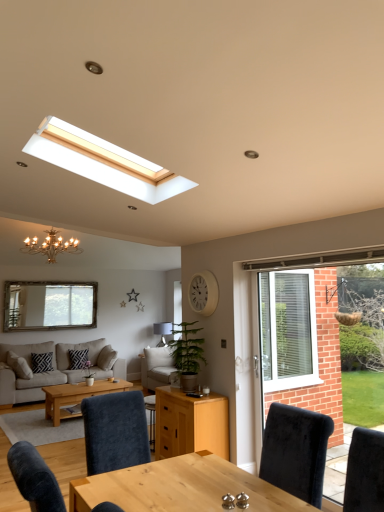
Describe the element at coordinates (54, 369) in the screenshot. I see `beige fabric couch at lower left` at that location.

The height and width of the screenshot is (512, 384). What do you see at coordinates (78, 358) in the screenshot? I see `black textured pillow at center, the second pillow viewed from the left` at bounding box center [78, 358].

The image size is (384, 512). What do you see at coordinates (51, 246) in the screenshot? I see `gold metallic chandelier at upper left` at bounding box center [51, 246].

The image size is (384, 512). What do you see at coordinates (41, 362) in the screenshot? I see `black textured pillow at lower left, the 1th pillow from the left` at bounding box center [41, 362].

You are a GUI agent. You are given a task and a screenshot of the screen. Output one action in this format:
    pyautogui.click(x=<x>, y=<y>)
    Task: Click on the metallic silver lampshade at center
    The image size is (384, 512).
    Given the screenshot: What is the action you would take?
    pyautogui.click(x=162, y=331)

Is the depth of black textured pillow at lower left, the second pillow viewed from the right, less than that of beige fabric couch at lower left?

No, the depth of black textured pillow at lower left, the second pillow viewed from the right, is greater than that of beige fabric couch at lower left.

Find the location of a particular element. The image size is (384, 512). pillow that is on the left side of beige fabric couch at lower left is located at coordinates (41, 362).

Which is more to the left, black textured pillow at lower left, the 1th pillow from the left, or beige fabric couch at lower left?

black textured pillow at lower left, the 1th pillow from the left.

From the picture: From a real-world perspective, is black textured pillow at lower left, the 1th pillow from the left, above or below beige fabric couch at lower left?

From a real-world perspective, black textured pillow at lower left, the 1th pillow from the left, is physically above beige fabric couch at lower left.

Considering the positions of objects gold metallic chandelier at upper left and light beige fabric couch at center in the image provided, who is more to the right, gold metallic chandelier at upper left or light beige fabric couch at center?

Positioned to the right is light beige fabric couch at center.

Is gold metallic chandelier at upper left not inside light beige fabric couch at center?

Indeed, gold metallic chandelier at upper left is completely outside light beige fabric couch at center.

From the picture: Looking at the image, does gold metallic chandelier at upper left seem bigger or smaller compared to light beige fabric couch at center?

gold metallic chandelier at upper left is bigger than light beige fabric couch at center.

Is black textured pillow at center, the second pillow viewed from the left, oriented towards light beige fabric couch at center?

No, black textured pillow at center, the second pillow viewed from the left, is not aimed at light beige fabric couch at center.

Is black textured pillow at center, the second pillow viewed from the left, in front of light beige fabric couch at center?

No.

What are the coordinates of `couch that is on the right side of black textured pillow at center, the second pillow viewed from the left` in the screenshot? It's located at (157, 367).

Is there a large distance between black textured pillow at center, acting as the 1th pillow starting from the right, and light beige fabric couch at center?

Yes.

From a real-world perspective, between wooden table at center and gold metallic chandelier at upper left, who is vertically higher?

From a 3D spatial view, gold metallic chandelier at upper left is above.

Is wooden table at center wider or thinner than gold metallic chandelier at upper left?

Clearly, wooden table at center has less width compared to gold metallic chandelier at upper left.

At what (x,y) coordinates should I click in order to perform the action: click on light fixture on the left of wooden table at center. Please return your answer as a coordinate pair (x, y). This screenshot has width=384, height=512. Looking at the image, I should click on (51, 246).

Relative to gold metallic chandelier at upper left, is wooden table at center in front or behind?

wooden table at center is positioned closer to the viewer than gold metallic chandelier at upper left.

Locate an element on the screen. This screenshot has height=512, width=384. studio couch located behind the light brown wooden coffee table at center is located at coordinates (54, 369).

Would you consider light brown wooden coffee table at center to be distant from beige fabric couch at lower left?

No, light brown wooden coffee table at center is not far from beige fabric couch at lower left.

Considering the positions of point (44, 389) and point (45, 345), is point (44, 389) closer or farther from the camera than point (45, 345)?

Point (44, 389) is closer to the camera than point (45, 345).

Based on their sizes in the image, would you say metallic silver lampshade at center is bigger or smaller than wooden table at center?

Clearly, metallic silver lampshade at center is smaller in size than wooden table at center.

Considering their positions, is metallic silver lampshade at center located in front of or behind wooden table at center?

In the image, metallic silver lampshade at center appears behind wooden table at center.

The width and height of the screenshot is (384, 512). I want to click on lamp that appears above the wooden table at center (from the image's perspective), so click(162, 331).

From the image's perspective, which one is positioned lower, metallic silver lampshade at center or wooden table at center?

wooden table at center, from the image's perspective.

From the image's perspective, is black textured pillow at lower left, the 1th pillow from the left, positioned above or below black textured pillow at center, the second pillow viewed from the left?

Clearly, from the image's perspective, black textured pillow at lower left, the 1th pillow from the left, is above black textured pillow at center, the second pillow viewed from the left.

Identify the location of pillow located behind the black textured pillow at lower left, the second pillow viewed from the right. (78, 358).

Can you tell me how much black textured pillow at lower left, the second pillow viewed from the right, and black textured pillow at center, acting as the 1th pillow starting from the right, differ in facing direction?

0.615 degrees separate the facing orientations of black textured pillow at lower left, the second pillow viewed from the right, and black textured pillow at center, acting as the 1th pillow starting from the right.

Considering the sizes of objects black textured pillow at lower left, the second pillow viewed from the right, and black textured pillow at center, the second pillow viewed from the left, in the image provided, who is thinner, black textured pillow at lower left, the second pillow viewed from the right, or black textured pillow at center, the second pillow viewed from the left,?

black textured pillow at lower left, the second pillow viewed from the right, is thinner.

You are a GUI agent. You are given a task and a screenshot of the screen. Output one action in this format:
    pyautogui.click(x=<x>, y=<y>)
    Task: Click on the studio couch below the black textured pillow at lower left, the 1th pillow from the left (from a real-world perspective)
    This screenshot has width=384, height=512.
    Given the screenshot: What is the action you would take?
    pyautogui.click(x=54, y=369)

Locate an element on the screen. couch that appears on the right of gold metallic chandelier at upper left is located at coordinates (157, 367).

Considering their positions, is gold metallic chandelier at upper left positioned closer to metallic silver lampshade at center than wooden table at center?

gold metallic chandelier at upper left is closer to metallic silver lampshade at center.

From the picture: Estimate the real-world distances between objects in this image. Which object is further from matte glass mirror at upper left, black textured pillow at center, the second pillow viewed from the left, or wooden table at center?

wooden table at center lies further to matte glass mirror at upper left than the other object.

Estimate the real-world distances between objects in this image. Which object is closer to beige fabric couch at lower left, wooden table at center or black textured pillow at center, acting as the 1th pillow starting from the right?

black textured pillow at center, acting as the 1th pillow starting from the right, lies closer to beige fabric couch at lower left than the other object.

From the image, which object appears to be nearer to metallic silver lampshade at center, light brown wooden coffee table at center or black textured pillow at center, acting as the 1th pillow starting from the right?

black textured pillow at center, acting as the 1th pillow starting from the right.

Considering their positions, is black textured pillow at lower left, the second pillow viewed from the right, positioned closer to light brown wooden coffee table at center than light beige fabric couch at center?

black textured pillow at lower left, the second pillow viewed from the right, is positioned closer to the anchor light brown wooden coffee table at center.

Estimate the real-world distances between objects in this image. Which object is further from beige fabric couch at lower left, black textured pillow at center, the second pillow viewed from the left, or matte glass mirror at upper left?

matte glass mirror at upper left is further to beige fabric couch at lower left.

Looking at the image, which one is located further to white matte clock at upper center, light beige fabric couch at center or wooden table at center?

Based on the image, light beige fabric couch at center appears to be further to white matte clock at upper center.

When comparing their distances from metallic silver lampshade at center, does black textured pillow at lower left, the 1th pillow from the left, or matte glass mirror at upper left seem closer?

matte glass mirror at upper left lies closer to metallic silver lampshade at center than the other object.

Identify the location of bay window positioned between gold metallic chandelier at upper left and black textured pillow at center, the second pillow viewed from the left, from near to far. (49, 305).

The image size is (384, 512). I want to click on coffee table between wooden table at center and black textured pillow at lower left, the 1th pillow from the left, in the front-back direction, so click(76, 396).

Where is `bay window located between light brown wooden coffee table at center and black textured pillow at center, acting as the 1th pillow starting from the right, in the depth direction`? This screenshot has height=512, width=384. bay window located between light brown wooden coffee table at center and black textured pillow at center, acting as the 1th pillow starting from the right, in the depth direction is located at coordinates (49, 305).

Where is `coffee table positioned between wooden table at center and black textured pillow at center, acting as the 1th pillow starting from the right, from near to far`? The image size is (384, 512). coffee table positioned between wooden table at center and black textured pillow at center, acting as the 1th pillow starting from the right, from near to far is located at coordinates (76, 396).